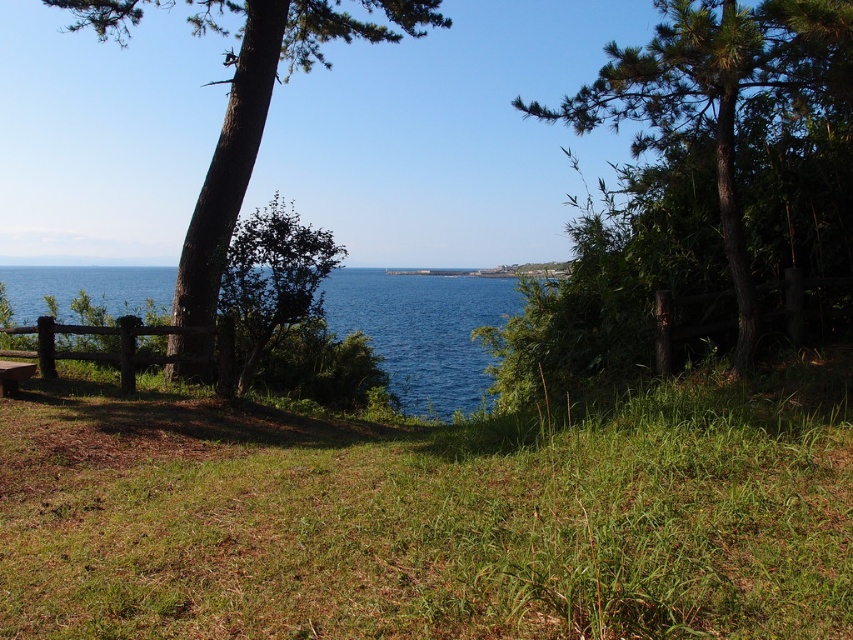
Is point (440, 413) less distant than point (4, 364)?

No, it is behind (4, 364).

Does blue water at center appear over brown wooden bench at lower left?

Correct, blue water at center is located above brown wooden bench at lower left.

Is point (405, 317) positioned before point (21, 364)?

No.

I want to click on blue water at center, so click(x=422, y=330).

Between point (213, 294) and point (463, 296), which one is positioned in front?

Point (213, 294)

Between green textured tree at left and blue water at center, which one is positioned higher?

green textured tree at left

Describe the element at coordinates (265, 109) in the screenshot. I see `green textured tree at left` at that location.

You are a GUI agent. You are given a task and a screenshot of the screen. Output one action in this format:
    pyautogui.click(x=<x>, y=<y>)
    Task: Click on the green textured tree at left
    Image resolution: width=853 pixels, height=640 pixels.
    Given the screenshot: What is the action you would take?
    pyautogui.click(x=265, y=109)

Who is more distant from viewer, (727, 160) or (364, 28)?

Positioned behind is point (364, 28).

Identify the location of green leafy tree at center. (708, 92).

What do you see at coordinates (708, 92) in the screenshot?
I see `green leafy tree at center` at bounding box center [708, 92].

This screenshot has width=853, height=640. Find the location of `green leafy tree at center`. green leafy tree at center is located at coordinates (708, 92).